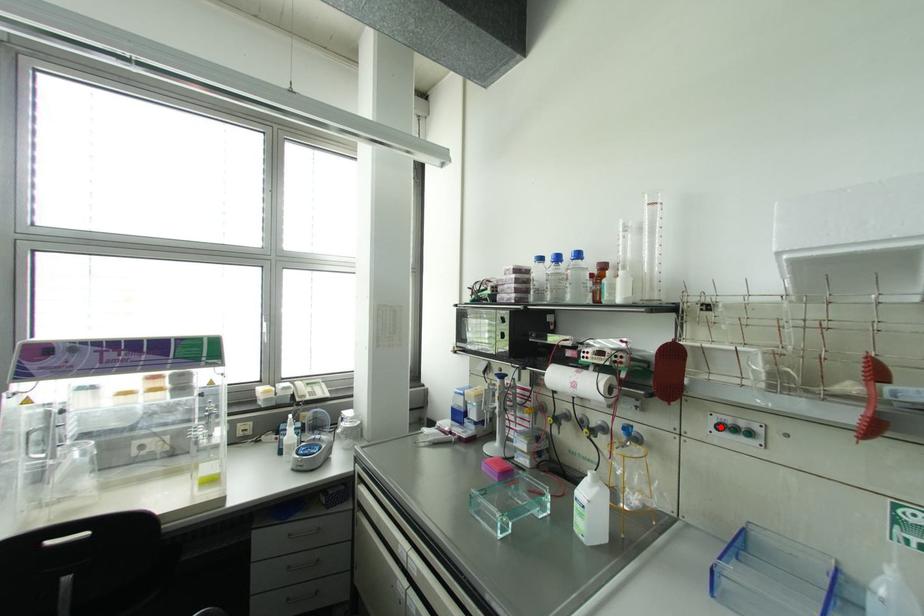
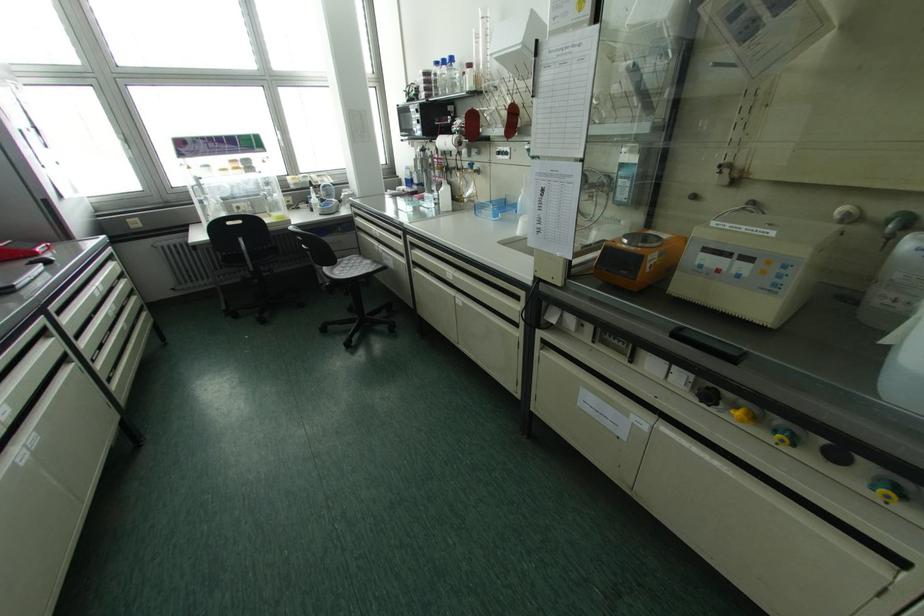
Question: I am providing you with two images of the same scene from different viewpoints. In image1, a red point is highlighted. Considering the same 3D point in image2, which of the following is correct?

Choices:
 (A) It is closer
 (B) It is farther

Answer: (A)